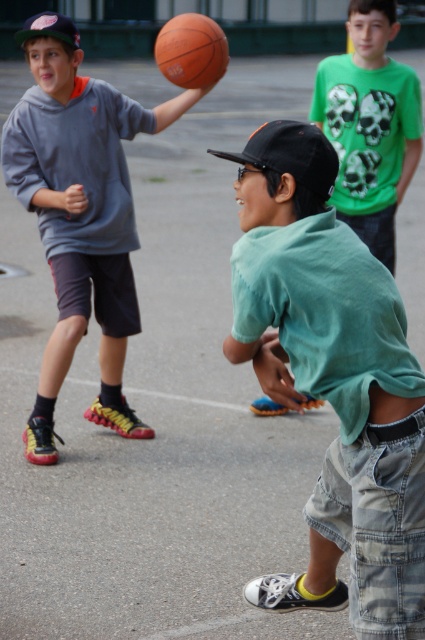
Is point (294, 272) positioned before point (74, 301)?

That is True.

Is green cotton shirt at center wider than matte gray hoodie at upper left?

Incorrect, green cotton shirt at center's width does not surpass matte gray hoodie at upper left's.

Identify the location of green cotton shirt at center. (333, 380).

Who is positioned more to the right, matte gray hoodie at upper left or orange matte basketball at upper center?

From the viewer's perspective, orange matte basketball at upper center appears more on the right side.

Does point (118, 320) lie in front of point (201, 19)?

No, it is not.

Image resolution: width=425 pixels, height=640 pixels. Find the location of `matte gray hoodie at upper left`. matte gray hoodie at upper left is located at coordinates (79, 212).

This screenshot has width=425, height=640. Find the location of `matte gray hoodie at upper left`. matte gray hoodie at upper left is located at coordinates (79, 212).

Is green cotton shirt at center below green matte shirt at center?

Correct, green cotton shirt at center is located below green matte shirt at center.

Is point (399, 406) farther from viewer compared to point (391, 189)?

No, it is in front of (391, 189).

Locate an element on the screen. The width and height of the screenshot is (425, 640). green cotton shirt at center is located at coordinates (333, 380).